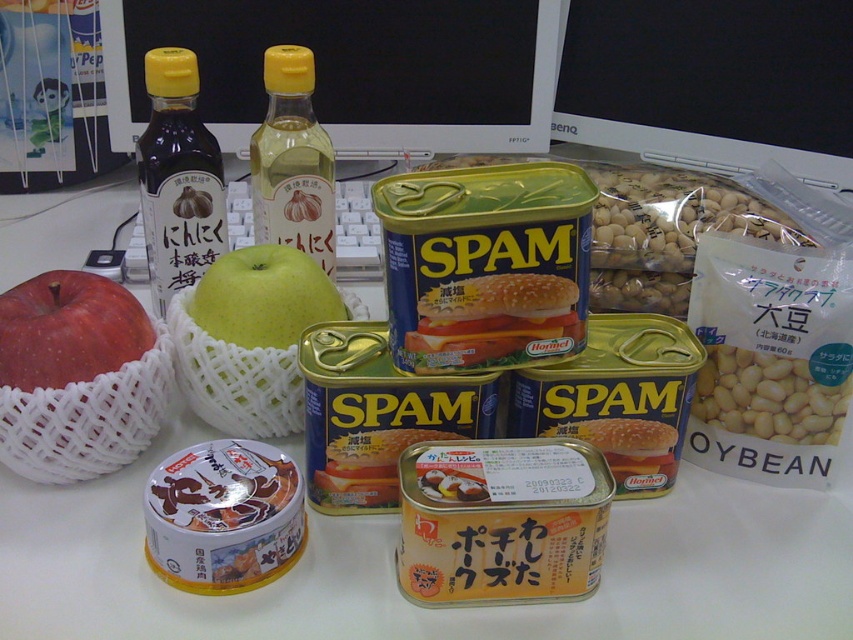
Consider the image. You are organizing items on a desk and need to place a new item between the apples and the SPAM cans. Given the black glossy computer monitor at upper center, can you determine the spatial relationship between the apples and SPAM cans to ensure the new item fits?

The black glossy computer monitor at upper center is located at point (711,81), but this does not provide direct information about the spatial arrangement between the apples and SPAM cans. To place the new item between them, you need to consider their positions relative to each other on the desk.

You are organizing the desk and need to place a new item between the matte glass bottle at upper left and the yellow plastic bottle at center. Based on their positions, where should you position this new item?

The matte glass bottle at upper left is located below the yellow plastic bottle at center, so to place the new item between them, position it above the matte glass bottle at upper left and below the yellow plastic bottle at center.